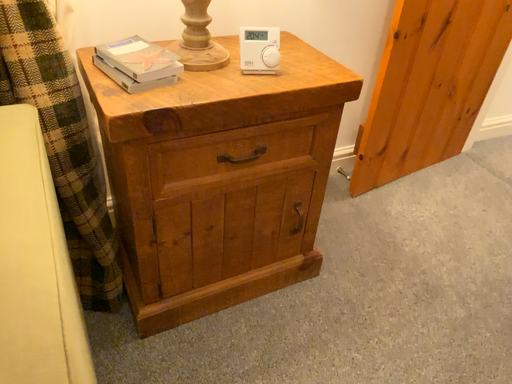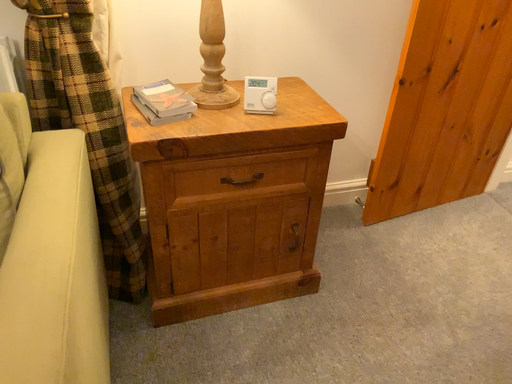
Question: Which way did the camera rotate in the video?

Choices:
 (A) rotated left
 (B) rotated right

Answer: (A)